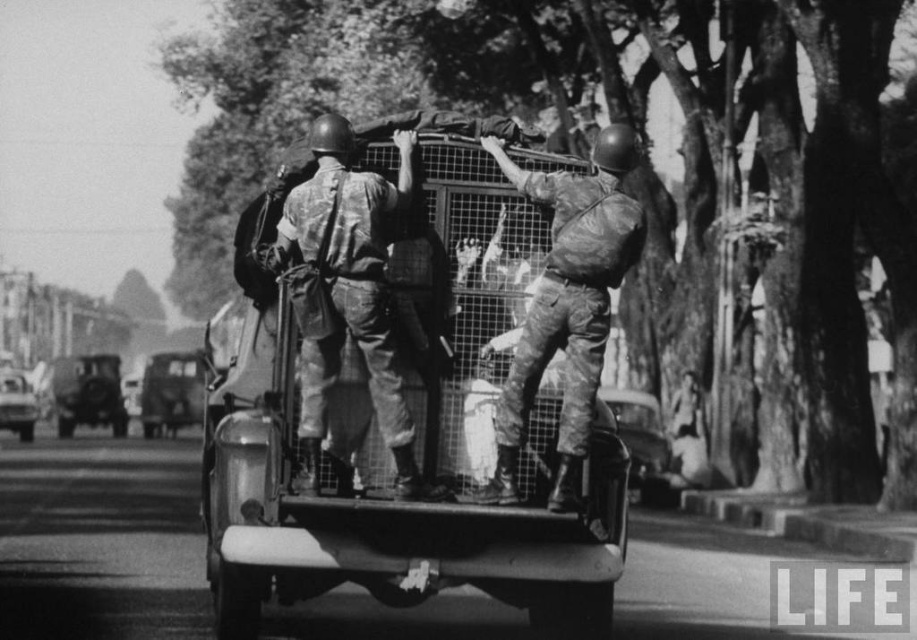
Question: Which object is farther from the camera taking this photo?

Choices:
 (A) camouflage fabric uniform at center
 (B) camouflage fabric soldier at center

Answer: (B)

Question: Is camouflage fabric uniform at center closer to the viewer compared to camouflage fabric soldier at center?

Choices:
 (A) yes
 (B) no

Answer: (A)

Question: Which object appears closest to the camera in this image?

Choices:
 (A) camouflage fabric uniform at center
 (B) camouflage fabric soldier at center

Answer: (A)

Question: Is camouflage fabric uniform at center positioned behind camouflage fabric soldier at center?

Choices:
 (A) yes
 (B) no

Answer: (B)

Question: Can you confirm if camouflage fabric uniform at center is wider than camouflage fabric soldier at center?

Choices:
 (A) yes
 (B) no

Answer: (A)